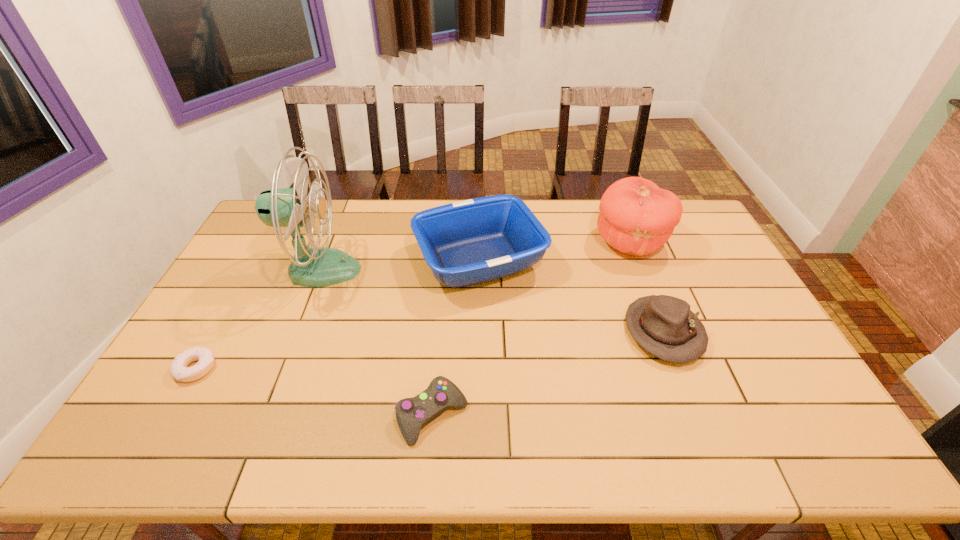
You are a GUI agent. You are given a task and a screenshot of the screen. Output one action in this format:
    pyautogui.click(x=<x>, y=<y>)
    Task: Click on the free space located on the left of the fifth shortest object
    The width and height of the screenshot is (960, 540).
    Given the screenshot: What is the action you would take?
    pyautogui.click(x=564, y=242)

Locate an element on the screen. vacant space situated 0.340m on the right of the tray is located at coordinates (647, 261).

Find the location of a particular element. free space located 0.170m on the decorative side of the fourth tallest object is located at coordinates (702, 429).

Where is `free region located 0.360m on the back of the fifth tallest object`? The image size is (960, 540). free region located 0.360m on the back of the fifth tallest object is located at coordinates (444, 288).

Where is `free spot located 0.090m on the back of the leftmost object`? The image size is (960, 540). free spot located 0.090m on the back of the leftmost object is located at coordinates (219, 328).

Identify the location of pumpkin that is positioned at the far edge. The image size is (960, 540). (636, 217).

Identify the location of tray that is at the far edge. The height and width of the screenshot is (540, 960). (473, 241).

Where is `object at the near edge`? object at the near edge is located at coordinates (412, 414).

Image resolution: width=960 pixels, height=540 pixels. Identify the location of object positioned at the left edge. (204, 356).

Identify the location of vacant region at the far edge of the desktop. (554, 219).